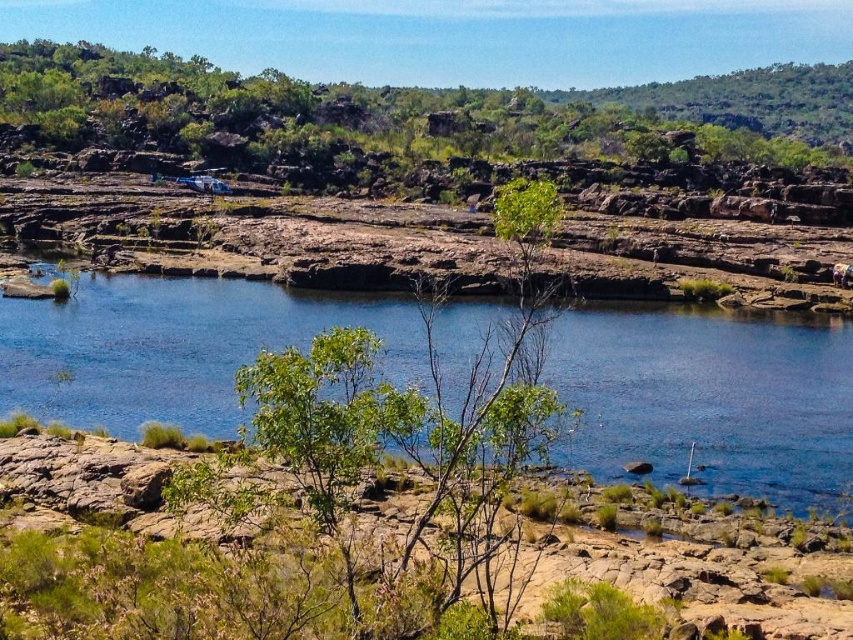
Question: Which object appears closest to the camera in this image?

Choices:
 (A) green leafy tree at upper center
 (B) blue smooth water at center

Answer: (B)

Question: Is blue smooth water at center above green leafy tree at upper center?

Choices:
 (A) no
 (B) yes

Answer: (A)

Question: Which object appears closest to the camera in this image?

Choices:
 (A) green leafy tree at upper center
 (B) blue smooth water at center

Answer: (B)

Question: Is blue smooth water at center below green leafy tree at upper center?

Choices:
 (A) no
 (B) yes

Answer: (B)

Question: Does blue smooth water at center appear under green leafy tree at upper center?

Choices:
 (A) yes
 (B) no

Answer: (A)

Question: Which point is closer to the camera?

Choices:
 (A) green leafy tree at upper center
 (B) blue smooth water at center

Answer: (B)